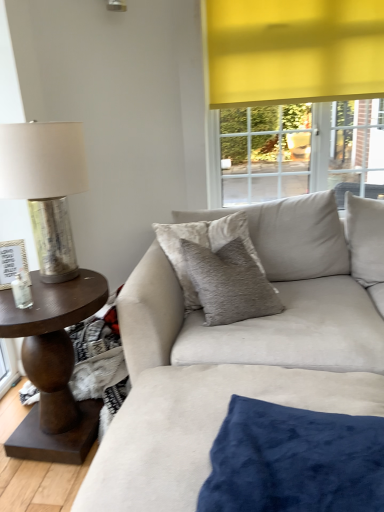
Question: Is the depth of velvet blue pillow at lower center, the second pillow when ordered from top to bottom, less than that of dark brown wood side table at left?

Choices:
 (A) no
 (B) yes

Answer: (B)

Question: Is velvet blue pillow at lower center, the 1th pillow positioned from the front, to the right of dark brown wood side table at left from the viewer's perspective?

Choices:
 (A) yes
 (B) no

Answer: (A)

Question: Can you confirm if velvet blue pillow at lower center, which appears as the first pillow when ordered from the bottom, is smaller than dark brown wood side table at left?

Choices:
 (A) yes
 (B) no

Answer: (A)

Question: Is velvet blue pillow at lower center, the second pillow when ordered from top to bottom, far away from dark brown wood side table at left?

Choices:
 (A) yes
 (B) no

Answer: (B)

Question: From the image's perspective, is velvet blue pillow at lower center, the second pillow in the back-to-front sequence, located above dark brown wood side table at left?

Choices:
 (A) no
 (B) yes

Answer: (A)

Question: Based on their positions, is velvet blue pillow at lower center, the second pillow in the back-to-front sequence, located to the left or right of suede couch at center?

Choices:
 (A) right
 (B) left

Answer: (B)

Question: From a real-world perspective, is velvet blue pillow at lower center, the 1th pillow positioned from the front, positioned above or below suede couch at center?

Choices:
 (A) above
 (B) below

Answer: (B)

Question: From the image's perspective, is velvet blue pillow at lower center, the 1th pillow positioned from the front, positioned above or below suede couch at center?

Choices:
 (A) below
 (B) above

Answer: (A)

Question: Considering the positions of velvet blue pillow at lower center, which appears as the first pillow when ordered from the bottom, and suede couch at center in the image, is velvet blue pillow at lower center, which appears as the first pillow when ordered from the bottom, taller or shorter than suede couch at center?

Choices:
 (A) tall
 (B) short

Answer: (B)

Question: From their relative heights in the image, would you say velvet blue pillow at lower center, which appears as the first pillow when ordered from the bottom, is taller or shorter than velvet beige pillow at center, acting as the 1th pillow starting from the back?

Choices:
 (A) tall
 (B) short

Answer: (B)

Question: Is point (271, 428) closer or farther from the camera than point (200, 242)?

Choices:
 (A) farther
 (B) closer

Answer: (B)

Question: Is velvet blue pillow at lower center, the second pillow in the back-to-front sequence, spatially inside velvet beige pillow at center, the 1th pillow from the top, or outside of it?

Choices:
 (A) outside
 (B) inside

Answer: (A)

Question: Looking at the image, does velvet blue pillow at lower center, which appears as the first pillow when ordered from the bottom, seem bigger or smaller compared to velvet beige pillow at center, positioned as the 2th pillow in front-to-back order?

Choices:
 (A) small
 (B) big

Answer: (B)

Question: In the image, is velvet beige pillow at center, acting as the 1th pillow starting from the back, positioned in front of or behind velvet blue pillow at lower center, which appears as the first pillow when ordered from the bottom?

Choices:
 (A) front
 (B) behind

Answer: (B)

Question: From their relative heights in the image, would you say velvet beige pillow at center, acting as the 1th pillow starting from the back, is taller or shorter than velvet blue pillow at lower center, the second pillow when ordered from top to bottom?

Choices:
 (A) tall
 (B) short

Answer: (A)